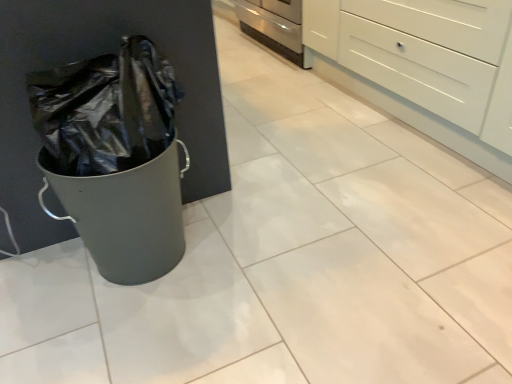
Question: From the image's perspective, is stainless steel oven at center beneath white glossy chest of drawers at upper right?

Choices:
 (A) yes
 (B) no

Answer: (B)

Question: Is stainless steel oven at center in contact with white glossy chest of drawers at upper right?

Choices:
 (A) yes
 (B) no

Answer: (B)

Question: Can you confirm if stainless steel oven at center is smaller than white glossy chest of drawers at upper right?

Choices:
 (A) yes
 (B) no

Answer: (A)

Question: Considering the relative sizes of stainless steel oven at center and white glossy chest of drawers at upper right in the image provided, is stainless steel oven at center thinner than white glossy chest of drawers at upper right?

Choices:
 (A) no
 (B) yes

Answer: (A)

Question: Does stainless steel oven at center have a larger size compared to white glossy chest of drawers at upper right?

Choices:
 (A) yes
 (B) no

Answer: (B)

Question: From a real-world perspective, does stainless steel oven at center sit lower than white glossy chest of drawers at upper right?

Choices:
 (A) no
 (B) yes

Answer: (B)

Question: Can you confirm if white glossy chest of drawers at upper right is positioned to the left of stainless steel oven at center?

Choices:
 (A) no
 (B) yes

Answer: (A)

Question: Considering the relative sizes of white glossy chest of drawers at upper right and stainless steel oven at center in the image provided, is white glossy chest of drawers at upper right taller than stainless steel oven at center?

Choices:
 (A) no
 (B) yes

Answer: (B)

Question: Is white glossy chest of drawers at upper right positioned behind stainless steel oven at center?

Choices:
 (A) yes
 (B) no

Answer: (B)

Question: Is white glossy chest of drawers at upper right outside stainless steel oven at center?

Choices:
 (A) yes
 (B) no

Answer: (A)

Question: Are white glossy chest of drawers at upper right and stainless steel oven at center beside each other?

Choices:
 (A) yes
 (B) no

Answer: (B)

Question: Is white glossy chest of drawers at upper right smaller than stainless steel oven at center?

Choices:
 (A) no
 (B) yes

Answer: (A)

Question: From a real-world perspective, relative to white glossy chest of drawers at upper right, is stainless steel oven at center vertically above or below?

Choices:
 (A) below
 (B) above

Answer: (A)